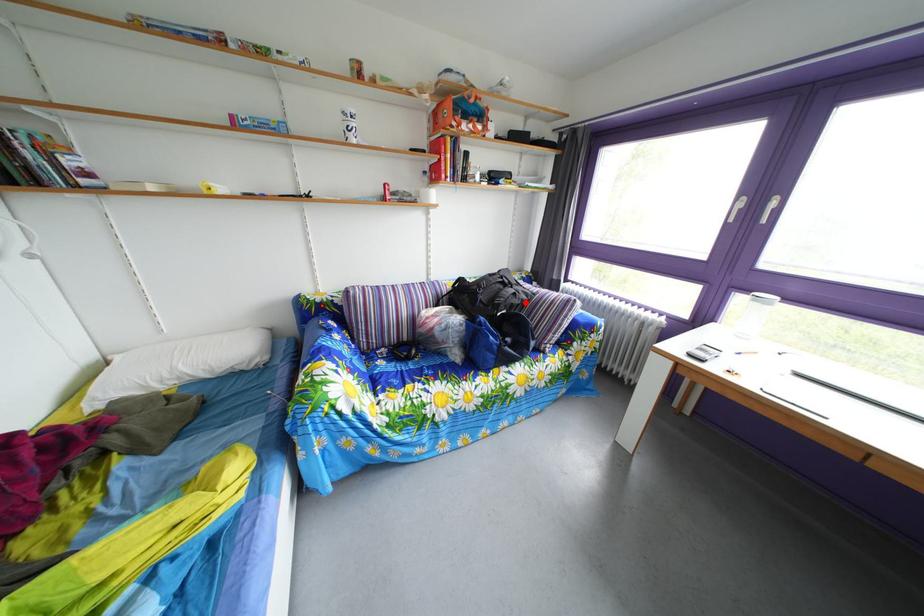
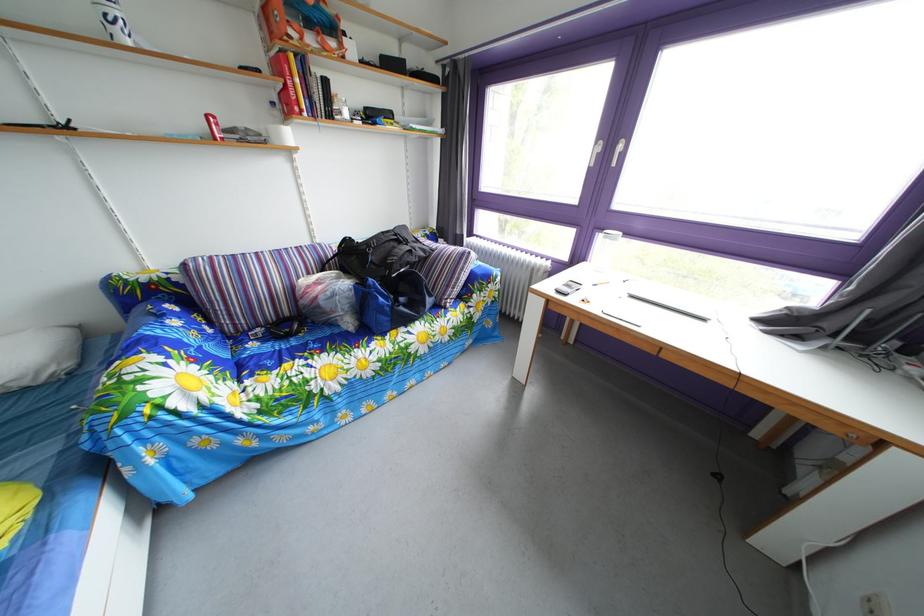
Find the pixel in the second image that matches the highlighted location in the first image.

(421, 260)